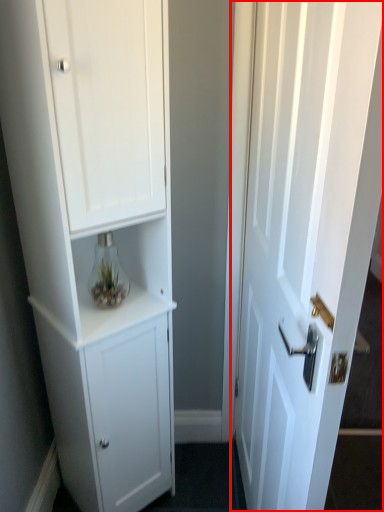
Question: From the image's perspective, what is the correct spatial relationship of door (annotated by the red box) in relation to cupboard?

Choices:
 (A) above
 (B) below

Answer: (B)